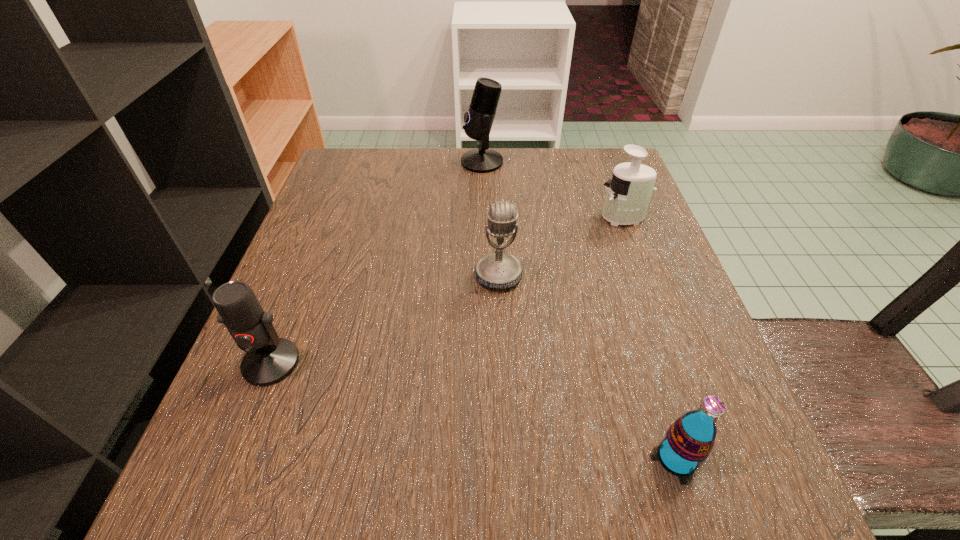
At what (x,y) coordinates should I click in order to perform the action: click on vacant region that satisfies the following two spatial constraints: 1. on the stand of the juicer; 2. on the right side of the tallest object. Please return your answer as a coordinate pair (x, y). Looking at the image, I should click on (482, 217).

Identify the location of vacant point that satisfies the following two spatial constraints: 1. on the side of the soda with the red ring; 2. on the right side of the leftmost microphone. The width and height of the screenshot is (960, 540). pyautogui.click(x=233, y=458).

Locate an element on the screen. This screenshot has height=540, width=960. vacant area in the image that satisfies the following two spatial constraints: 1. on the stand of the farthest object; 2. on the left side of the nearest object is located at coordinates (484, 458).

Find the location of a particular element. vacant space that satisfies the following two spatial constraints: 1. on the stand of the soda; 2. on the right side of the tallest microphone is located at coordinates (484, 458).

Identify the location of free point that satisfies the following two spatial constraints: 1. on the stand of the shortest object; 2. on the right side of the tallest object. pos(484,458).

At what (x,y) coordinates should I click in order to perform the action: click on free spot that satisfies the following two spatial constraints: 1. on the stand of the farthest microphone; 2. on the left side of the fourth nearest object. Please return your answer as a coordinate pair (x, y). Looking at the image, I should click on (482, 217).

This screenshot has width=960, height=540. Identify the location of vacant space that satisfies the following two spatial constraints: 1. on the stand of the tallest microphone; 2. on the side of the leftmost object with the red ring. (483, 363).

Locate an element on the screen. This screenshot has width=960, height=540. free point that satisfies the following two spatial constraints: 1. on the front-facing side of the shortest object; 2. on the right side of the second nearest microphone is located at coordinates (506, 458).

Identify the location of vacant region that satisfies the following two spatial constraints: 1. on the stand of the tallest microphone; 2. on the side of the nearest microphone with the red ring. This screenshot has width=960, height=540. (483, 363).